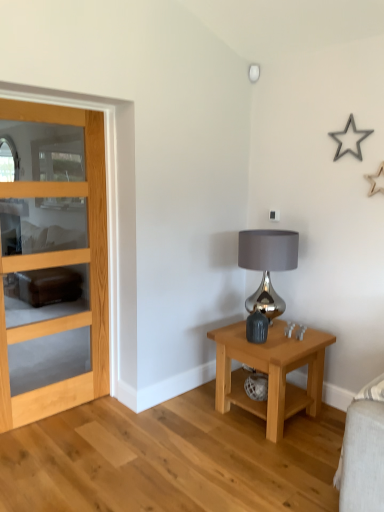
Find the location of a particular element. The width and height of the screenshot is (384, 512). vacant space situated on the left part of light wood/finish nightstand at lower right is located at coordinates (191, 421).